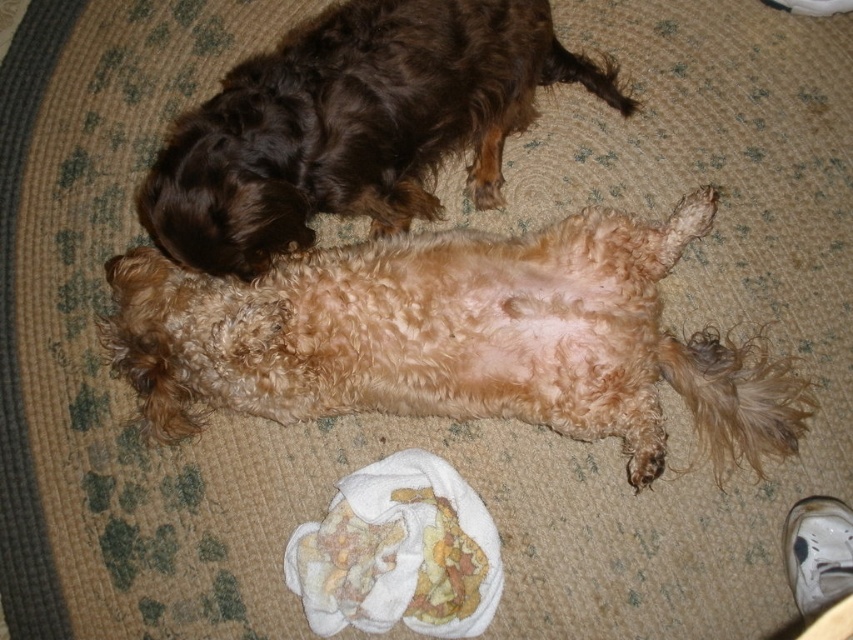
You are a pet sitter who needs to dry the fuzzy light brown dog at center. The printed fabric cloth at lower center is available. Can you use the cloth to dry the dog without moving the dog?

The fuzzy light brown dog at center is located above the printed fabric cloth at lower center, so you can reach the cloth by moving your hand downward from the dog to access it for drying without needing to move the dog.

You are a pet sitter who needs to place a new blanket over the fuzzy light brown dog at center and the printed fabric cloth at lower center. Based on their positions, which object should you move first to make space?

The fuzzy light brown dog at center is positioned on the right side of the printed fabric cloth at lower center. To make space, you should move the printed fabric cloth at lower center first since it is on the left side, allowing the dog to stay in place while the cloth is moved out of the way.

You are a pet sitter who needs to choose a blanket size for each dog. The fuzzy light brown dog at center requires a larger blanket than the shiny brown fur at upper left. Which dog needs the bigger blanket?

The fuzzy light brown dog at center needs the bigger blanket because its width is larger than the shiny brown fur at upper left.